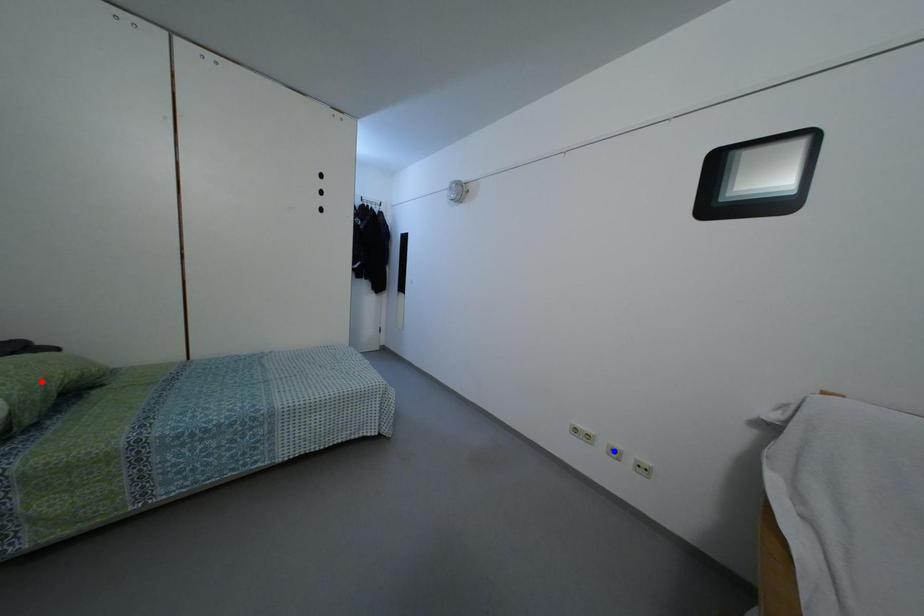
Question: Which of the two points in the image is closer to the camera?

Choices:
 (A) Blue point is closer.
 (B) Red point is closer.

Answer: (B)